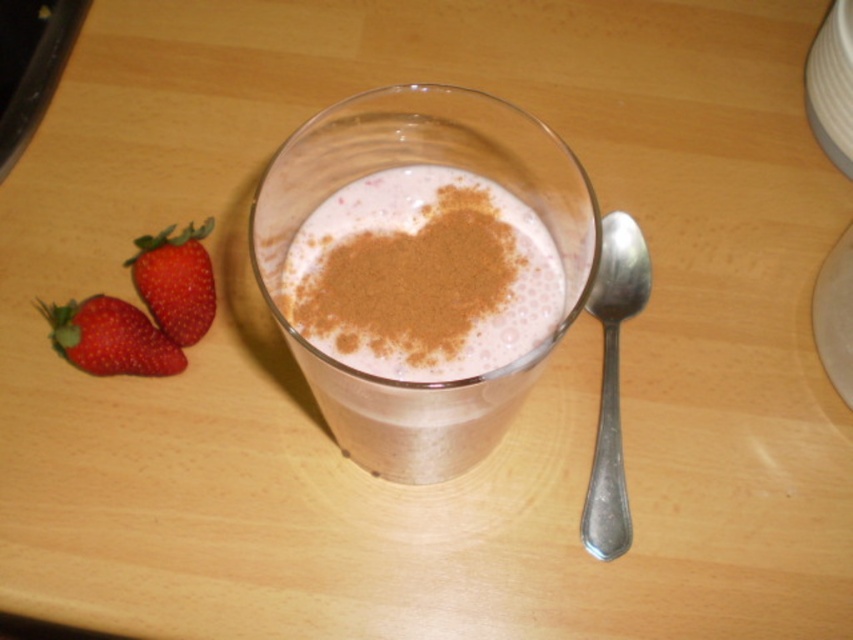
You have a small cookie that is 3 cm in diameter. You want to place it on the table next to the smoothie with cinnamon at center and the red glossy strawberry at lower left. Which object should you place it closer to if the cookie is wider than the smoothie?

The cookie should be placed closer to the red glossy strawberry at lower left because the smoothie with cinnamon at center is wider than the cookie, so the cookie would fit better near the smaller strawberry.

You are a bartender preparing a drink. You have a silver metallic spoon at right and a red matte strawberry at left. Which object is closer to the edge of the table?

The silver metallic spoon at right is positioned on the right side of red matte strawberry at left, so the spoon is closer to the right edge of the table.

In the scene shown: You want to place the silver metallic spoon at right into the smoothie with cinnamon at center. Will the spoon fit inside the smoothie?

The smoothie with cinnamon at center might be wider than silver metallic spoon at right, so the spoon should fit inside the smoothie.